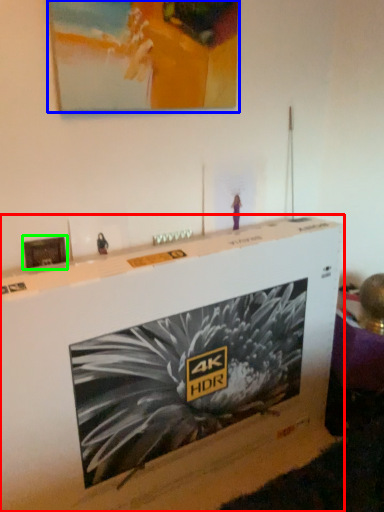
Question: Which object is positioned farthest from furniture (highlighted by a red box)? Select from picture frame (highlighted by a blue box) and picture frame (highlighted by a green box).

Choices:
 (A) picture frame
 (B) picture frame

Answer: (A)